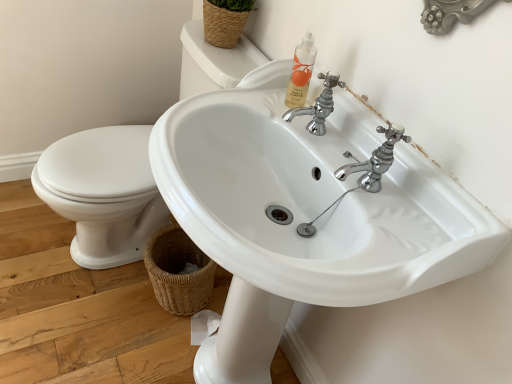
Question: Considering the relative positions of white glossy sink at center, the second sink positioned from the left, and white glossy sink at center, which ranks as the 1th sink in left-to-right order, in the image provided, is white glossy sink at center, the second sink positioned from the left, to the left of white glossy sink at center, which ranks as the 1th sink in left-to-right order, from the viewer's perspective?

Choices:
 (A) no
 (B) yes

Answer: (A)

Question: Considering the relative positions of white glossy sink at center, positioned as the first sink in right-to-left order, and white glossy sink at center, which ranks as the 1th sink in left-to-right order, in the image provided, is white glossy sink at center, positioned as the first sink in right-to-left order, to the right of white glossy sink at center, which ranks as the 1th sink in left-to-right order, from the viewer's perspective?

Choices:
 (A) no
 (B) yes

Answer: (B)

Question: Is white glossy sink at center, the second sink positioned from the left, positioned before white glossy sink at center, arranged as the second sink when viewed from the right?

Choices:
 (A) no
 (B) yes

Answer: (B)

Question: Considering the relative sizes of white glossy sink at center, positioned as the first sink in right-to-left order, and white glossy sink at center, which ranks as the 1th sink in left-to-right order, in the image provided, is white glossy sink at center, positioned as the first sink in right-to-left order, shorter than white glossy sink at center, which ranks as the 1th sink in left-to-right order,?

Choices:
 (A) no
 (B) yes

Answer: (A)

Question: Is the surface of white glossy sink at center, positioned as the first sink in right-to-left order, in direct contact with white glossy sink at center, which ranks as the 1th sink in left-to-right order?

Choices:
 (A) yes
 (B) no

Answer: (B)

Question: Is white glossy sink at center, which ranks as the 1th sink in left-to-right order, a part of white glossy sink at center, the second sink positioned from the left?

Choices:
 (A) no
 (B) yes

Answer: (A)

Question: Does woven straw basket at upper center, the first basket viewed from the top, appear on the left side of white glossy sink at center, which ranks as the 1th sink in left-to-right order?

Choices:
 (A) no
 (B) yes

Answer: (A)

Question: Is woven straw basket at upper center, the first basket viewed from the top, looking in the opposite direction of white glossy sink at center, arranged as the second sink when viewed from the right?

Choices:
 (A) yes
 (B) no

Answer: (B)

Question: Considering the relative sizes of woven straw basket at upper center, the 2th basket in the bottom-to-top sequence, and white glossy sink at center, arranged as the second sink when viewed from the right, in the image provided, is woven straw basket at upper center, the 2th basket in the bottom-to-top sequence, taller than white glossy sink at center, arranged as the second sink when viewed from the right,?

Choices:
 (A) yes
 (B) no

Answer: (B)

Question: From the image's perspective, does woven straw basket at upper center, the first basket viewed from the top, appear lower than white glossy sink at center, arranged as the second sink when viewed from the right?

Choices:
 (A) yes
 (B) no

Answer: (B)

Question: Could you tell me if woven straw basket at upper center, the 2th basket in the bottom-to-top sequence, is turned towards white glossy sink at center, arranged as the second sink when viewed from the right?

Choices:
 (A) no
 (B) yes

Answer: (A)

Question: Is the position of woven straw basket at upper center, the first basket viewed from the top, more distant than that of white glossy sink at center, arranged as the second sink when viewed from the right?

Choices:
 (A) no
 (B) yes

Answer: (B)

Question: Is the depth of white glossy sink at center, which ranks as the 1th sink in left-to-right order, greater than that of brown woven basket at lower left, positioned as the first basket in bottom-to-top order?

Choices:
 (A) no
 (B) yes

Answer: (A)